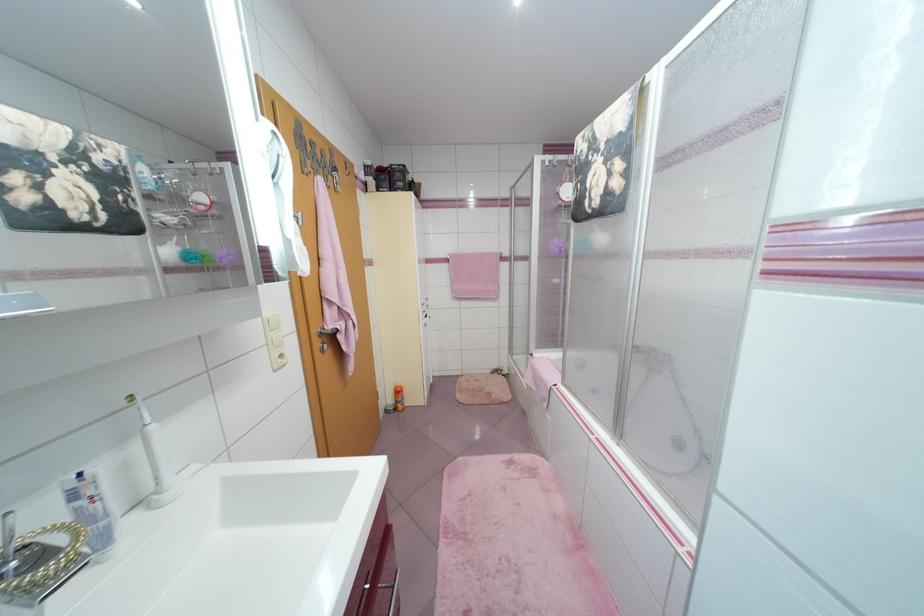
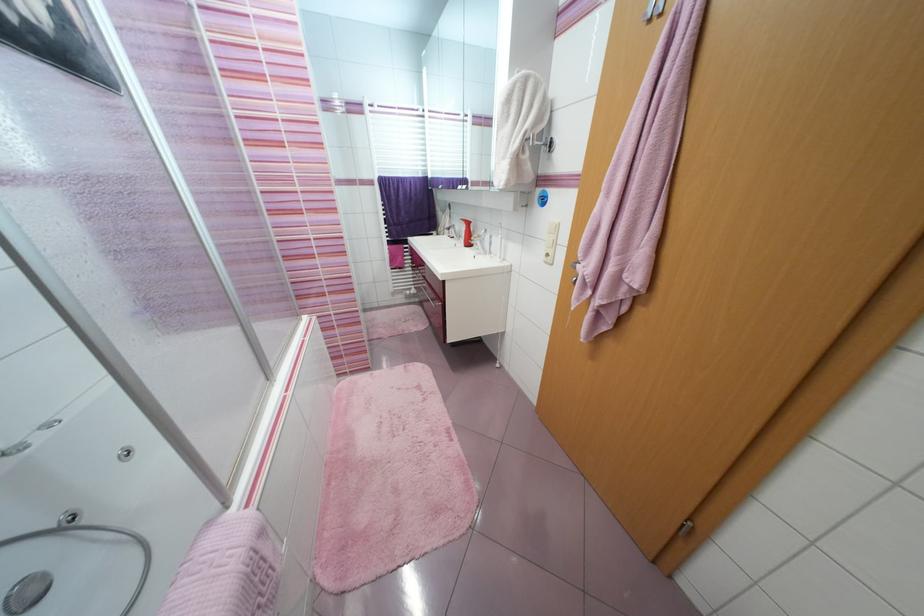
Where in the second image is the point corresponding to pixel 280 373 from the first image?

(551, 264)